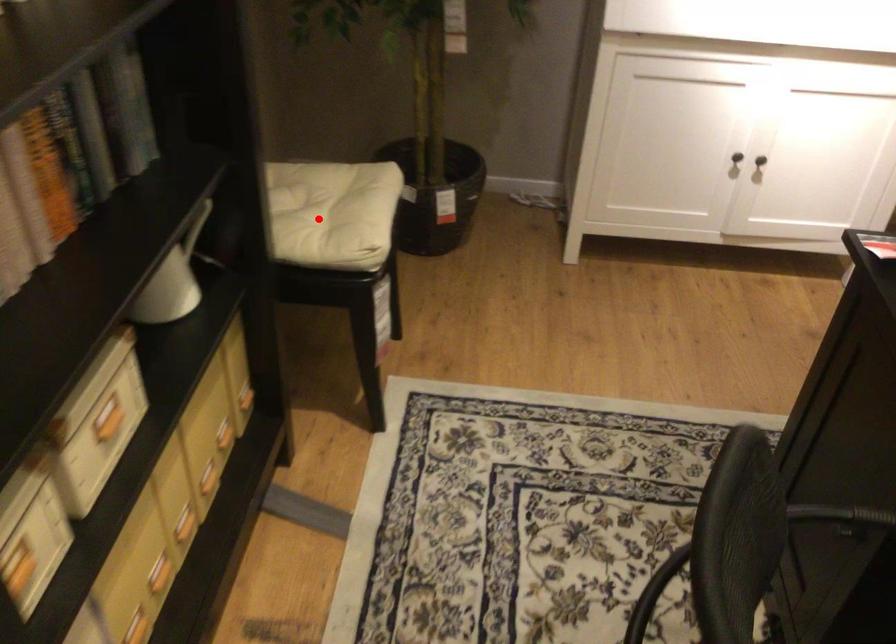
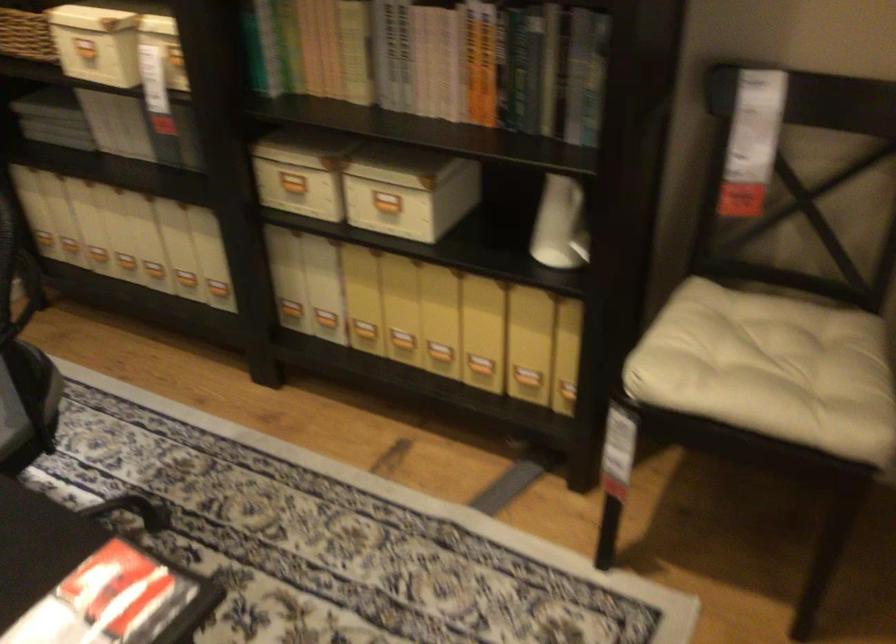
In the second image, find the point that corresponds to the highlighted location in the first image.

(776, 366)